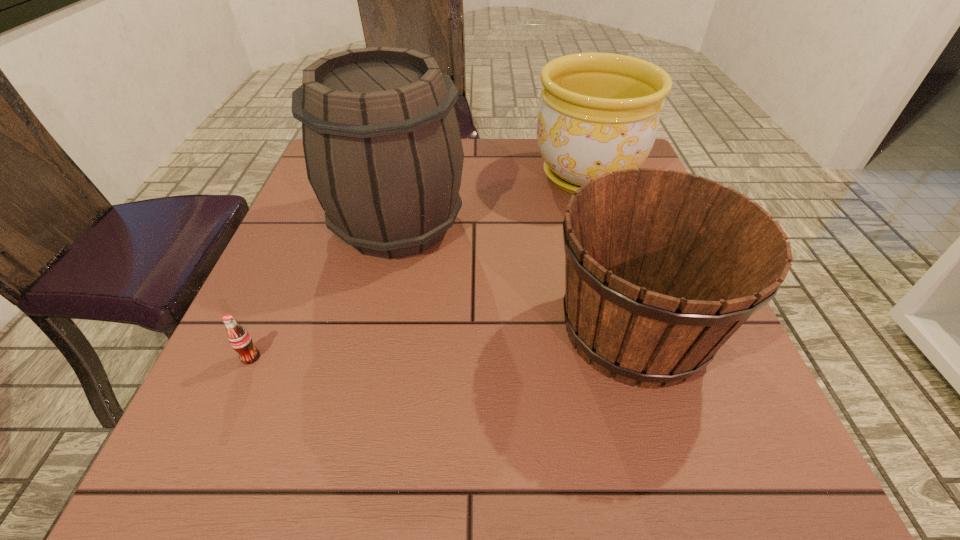
Locate an element on the screen. This screenshot has width=960, height=540. wine bucket at the far edge is located at coordinates (383, 151).

At what (x,y) coordinates should I click in order to perform the action: click on flowerpot located at the far edge. Please return your answer as a coordinate pair (x, y). The image size is (960, 540). Looking at the image, I should click on (600, 112).

Where is `wine bucket present at the left edge`? The image size is (960, 540). wine bucket present at the left edge is located at coordinates (383, 151).

Where is `soda present at the left edge`? soda present at the left edge is located at coordinates (240, 340).

Where is `flowerpot at the right edge`? flowerpot at the right edge is located at coordinates (600, 112).

The image size is (960, 540). I want to click on wine bucket that is positioned at the right edge, so click(x=662, y=267).

The width and height of the screenshot is (960, 540). Find the location of `object that is at the far left corner`. object that is at the far left corner is located at coordinates (383, 151).

This screenshot has width=960, height=540. Find the location of `object located at the far right corner`. object located at the far right corner is located at coordinates (600, 112).

You are a GUI agent. You are given a task and a screenshot of the screen. Output one action in this format:
    pyautogui.click(x=<x>, y=<y>)
    Task: Click on the free space at the far edge
    The image size is (960, 540).
    Given the screenshot: What is the action you would take?
    pyautogui.click(x=540, y=156)

Identify the location of vacant space at the near edge. (278, 495).